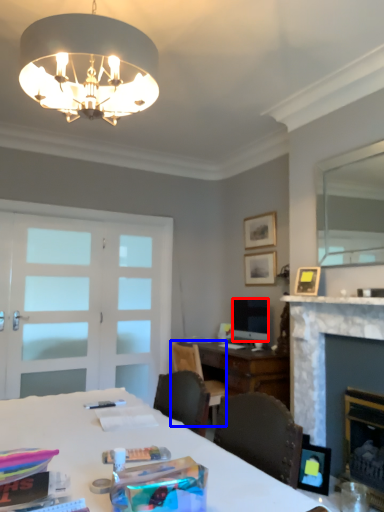
Question: Which point is closer to the camera, television (highlighted by a red box) or chair (highlighted by a blue box)?

Choices:
 (A) television
 (B) chair

Answer: (B)